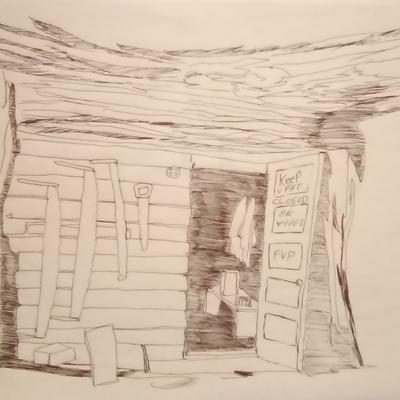
The height and width of the screenshot is (400, 400). Identify the location of door knob. (298, 282).